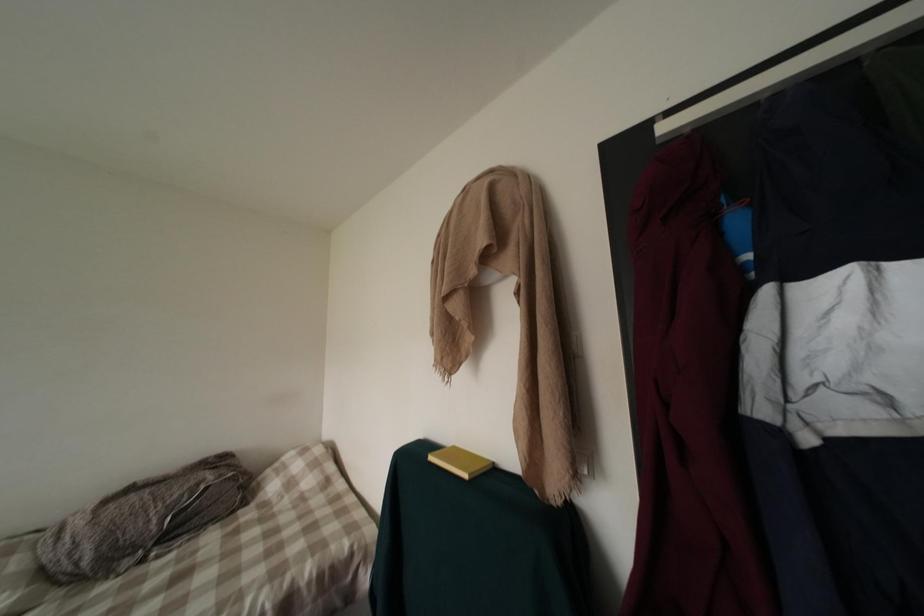
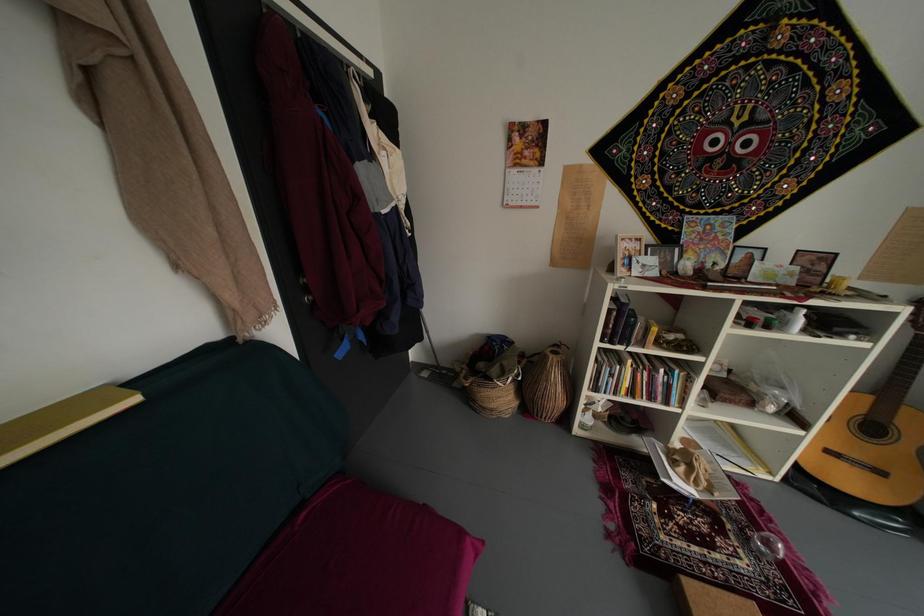
First-person continuous shooting, in which direction is the camera rotating?

The rotation direction of the camera is right-down.